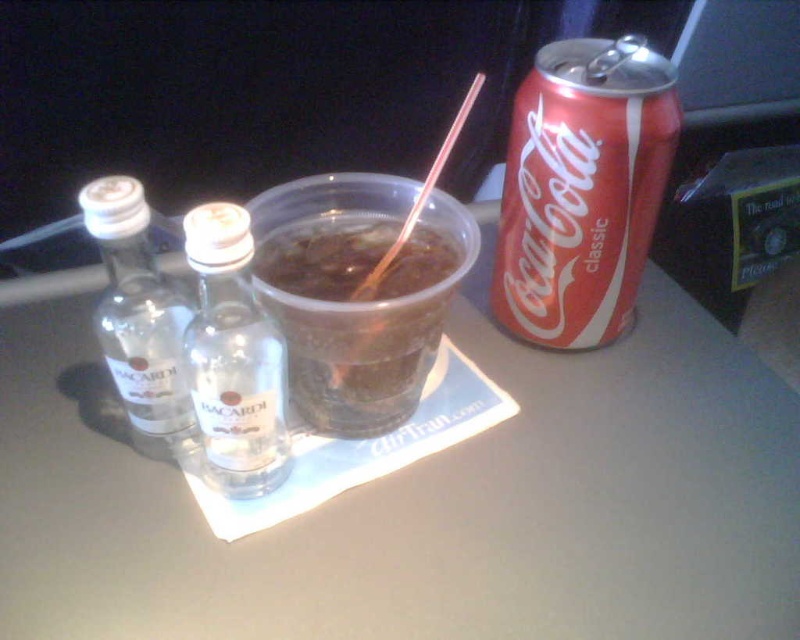
You are standing at the table and want to place a new item between the two points labeled point (600,339) and point (408,394). Which point should you use as your starting reference to ensure the item is placed correctly?

You should use point (408,394) as your starting reference because point (600,339) is behind it, so placing the item relative to the forward point ensures visibility and accessibility.

You are setting up a table for a party and want to place a decorative item between the clear plastic table at center and the translucent plastic cup at center. The decorative item is 5 inches wide. Will it fit in the space between them?

The space between the clear plastic table at center and the translucent plastic cup at center is 5.13 inches, so a decorative item that is 5 inches wide will fit since it is narrower than the available space.

You are setting up a table for a party and need to place a decorative centerpiece. The table is represented by the clear plastic table at center. Where exactly should you place the centerpiece to ensure it is centered on the table?

The clear plastic table at center is located at point [425,502], so you should place the centerpiece at those coordinates to center it on the table.